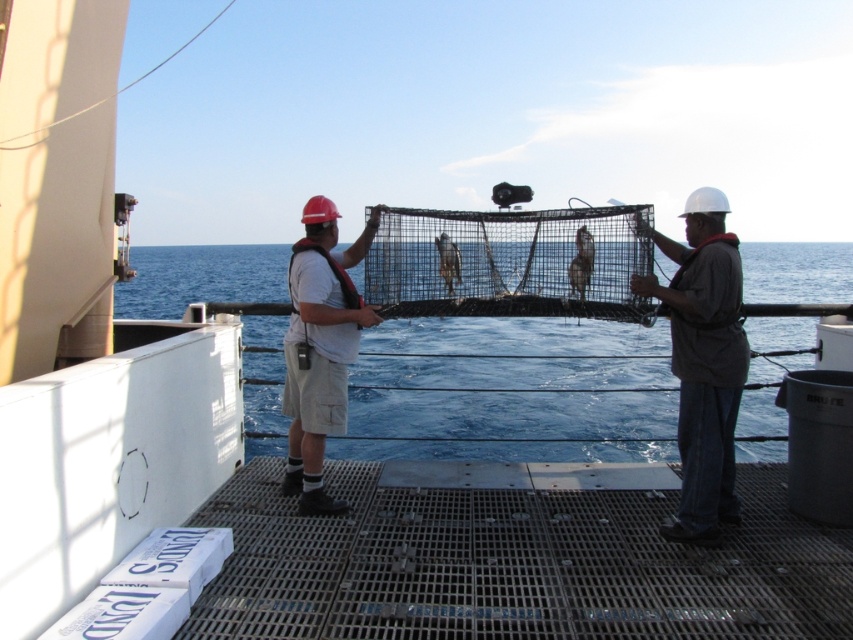
Question: Is dark gray fabric shirt at right in front of shiny silver fish at center?

Choices:
 (A) no
 (B) yes

Answer: (B)

Question: Can you confirm if dark gray fabric shirt at right is smaller than shiny silver fish at center?

Choices:
 (A) no
 (B) yes

Answer: (A)

Question: Which object is closer to the camera taking this photo?

Choices:
 (A) dark gray fabric shirt at right
 (B) shiny silver fish at center
 (C) white matte shirt at center

Answer: (A)

Question: Does dark gray fabric shirt at right appear over brown matte fish at center?

Choices:
 (A) yes
 (B) no

Answer: (B)

Question: Which point is farther to the camera?

Choices:
 (A) (310, 241)
 (B) (450, 248)
 (C) (363, 342)
 (D) (584, 234)

Answer: (C)

Question: Estimate the real-world distances between objects in this image. Which object is closer to the white matte shirt at center?

Choices:
 (A) dark gray fabric shirt at right
 (B) shiny silver fish at center
 (C) brown matte fish at center
 (D) blue water at center

Answer: (C)